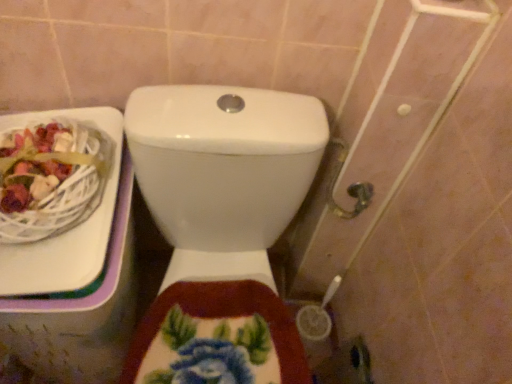
Question: Is point (79, 157) positioned closer to the camera than point (174, 374)?

Choices:
 (A) closer
 (B) farther

Answer: (A)

Question: Is white wicker basket at upper left wider or thinner than white glossy toilet at center?

Choices:
 (A) wide
 (B) thin

Answer: (B)

Question: From a real-world perspective, is white wicker basket at upper left physically located above or below white glossy toilet at center?

Choices:
 (A) below
 (B) above

Answer: (B)

Question: Considering the relative positions of white glossy toilet at center and white wicker basket at upper left in the image provided, is white glossy toilet at center to the left or to the right of white wicker basket at upper left?

Choices:
 (A) left
 (B) right

Answer: (B)

Question: From a real-world perspective, relative to white wicker basket at upper left, is white glossy toilet at center vertically above or below?

Choices:
 (A) below
 (B) above

Answer: (A)

Question: Is white glossy toilet at center taller or shorter than white wicker basket at upper left?

Choices:
 (A) tall
 (B) short

Answer: (A)

Question: Does point (154, 125) appear closer or farther from the camera than point (76, 122)?

Choices:
 (A) closer
 (B) farther

Answer: (A)